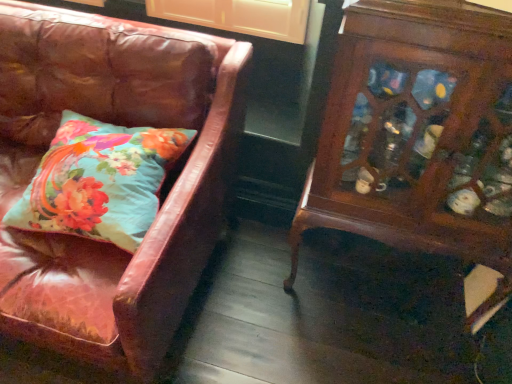
This screenshot has width=512, height=384. What are the coordinates of `free spot above teal floral pillow at left (from a real-world perspective)` in the screenshot? It's located at (109, 160).